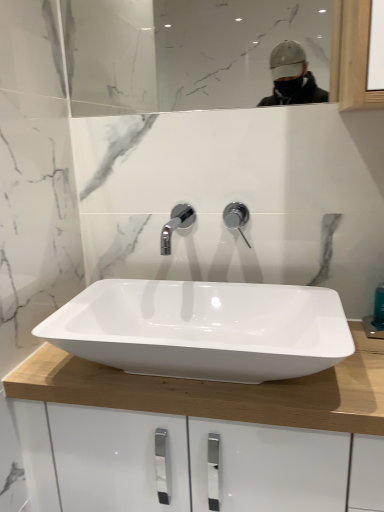
Question: From the image's perspective, does clear glass mirror at upper center appear higher than white glossy sink at center?

Choices:
 (A) no
 (B) yes

Answer: (B)

Question: Would you say clear glass mirror at upper center contains white glossy sink at center?

Choices:
 (A) no
 (B) yes

Answer: (A)

Question: Could you tell me if clear glass mirror at upper center is turned towards white glossy sink at center?

Choices:
 (A) no
 (B) yes

Answer: (A)

Question: Is clear glass mirror at upper center oriented away from white glossy sink at center?

Choices:
 (A) yes
 (B) no

Answer: (B)

Question: Can you see clear glass mirror at upper center touching white glossy sink at center?

Choices:
 (A) yes
 (B) no

Answer: (B)

Question: Relative to white glossy sink at center, is clear glass mirror at upper center in front or behind?

Choices:
 (A) behind
 (B) front

Answer: (A)

Question: From the image's perspective, is clear glass mirror at upper center located above or below white glossy sink at center?

Choices:
 (A) above
 (B) below

Answer: (A)

Question: From a real-world perspective, is clear glass mirror at upper center above or below white glossy sink at center?

Choices:
 (A) below
 (B) above

Answer: (B)

Question: Considering the positions of clear glass mirror at upper center and white glossy sink at center in the image, is clear glass mirror at upper center taller or shorter than white glossy sink at center?

Choices:
 (A) short
 (B) tall

Answer: (B)

Question: Based on their sizes in the image, would you say polished chrome tap at center is bigger or smaller than clear glass mirror at upper center?

Choices:
 (A) big
 (B) small

Answer: (B)

Question: Considering the relative positions of polished chrome tap at center and clear glass mirror at upper center in the image provided, is polished chrome tap at center to the left or to the right of clear glass mirror at upper center?

Choices:
 (A) left
 (B) right

Answer: (B)

Question: Is polished chrome tap at center situated inside clear glass mirror at upper center or outside?

Choices:
 (A) inside
 (B) outside

Answer: (B)

Question: From the image's perspective, relative to clear glass mirror at upper center, is polished chrome tap at center above or below?

Choices:
 (A) below
 (B) above

Answer: (A)

Question: In the image, is white glossy sink at center on the left side or the right side of polished chrome tap at center?

Choices:
 (A) right
 (B) left

Answer: (B)

Question: Do you think white glossy sink at center is within polished chrome tap at center, or outside of it?

Choices:
 (A) outside
 (B) inside

Answer: (A)